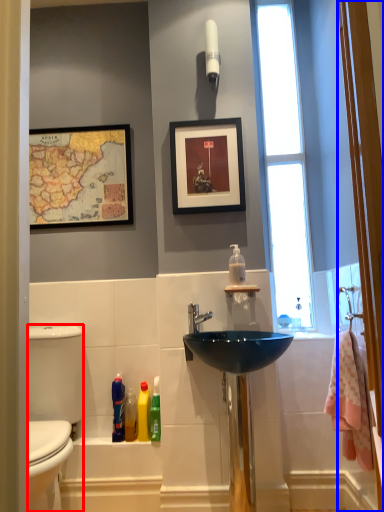
Question: Which object appears closest to the camera in this image, gray (highlighted by a red box) or screen door (highlighted by a blue box)?

Choices:
 (A) gray
 (B) screen door

Answer: (B)